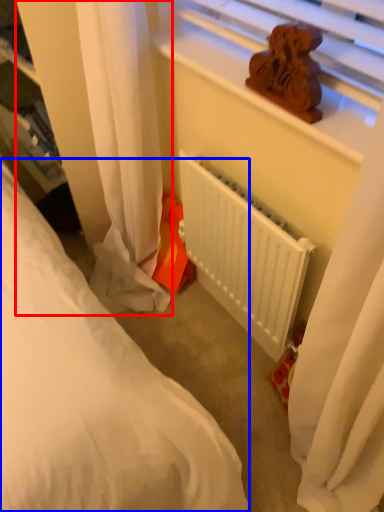
Question: Which object appears closest to the camera in this image, curtain (highlighted by a red box) or bed (highlighted by a blue box)?

Choices:
 (A) curtain
 (B) bed

Answer: (A)